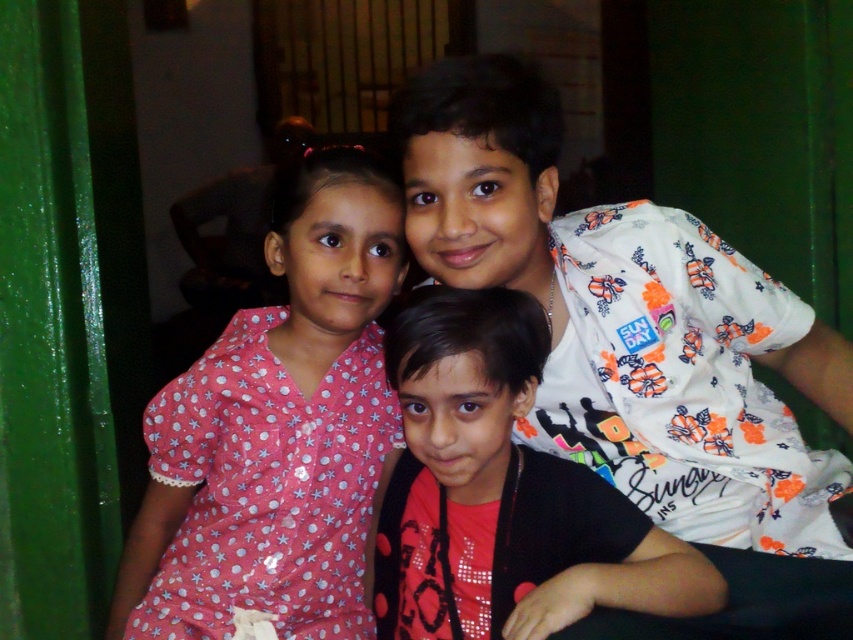
You are standing in the room where the three children are posing. You notice two points marked in the image. Which point is closer to you, point 1 at coordinates (178, 573) or point 2 at coordinates (491, 420)?

Point 1 at coordinates (178, 573) is closer to you because it is further to the viewer than point 2 at coordinates (491, 420).

In the scene shown: In the image of the three children, which child is wearing the white floral shirt at upper right and is positioned to the right of the pink dotted dress at left?

The white floral shirt at upper right is positioned on the right side of the pink dotted dress at left, so the child wearing the white floral shirt at upper right is to the right of the child in the pink dotted dress at left.

You are standing in the room and want to move from the point at coordinates point (x=775, y=369) to the point at coordinates point (x=225, y=579). Can you walk directly between them without needing to go around any obstacles?

Point (x=775, y=369) is behind point (x=225, y=579), so you would need to go around the obstacle in front of point (x=225, y=579) to reach it.